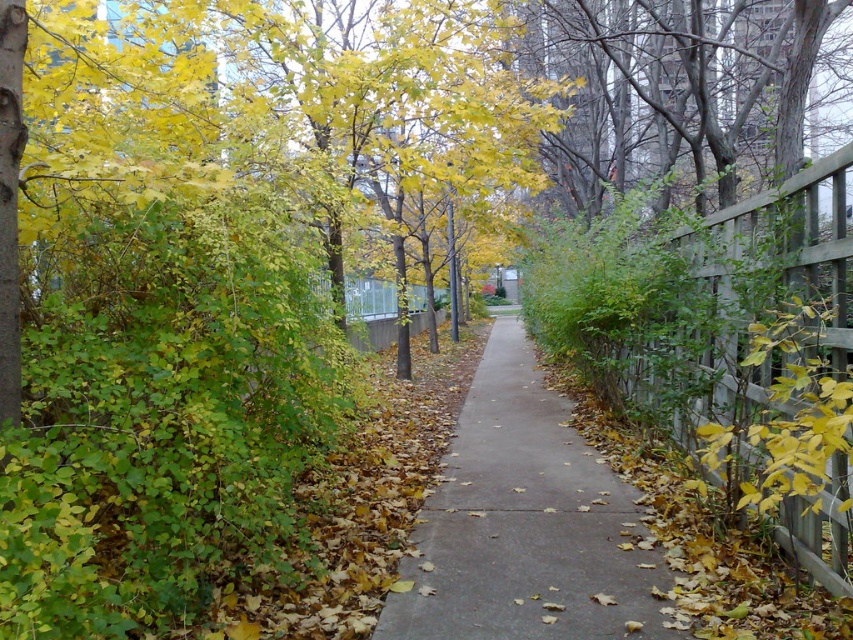
Question: Which object appears farthest from the camera in this image?

Choices:
 (A) wooden fence at right
 (B) gray concrete sidewalk at center

Answer: (B)

Question: Where is gray concrete sidewalk at center located in relation to wooden fence at right in the image?

Choices:
 (A) below
 (B) above

Answer: (A)

Question: Which point is closer to the camera?

Choices:
 (A) (654, 552)
 (B) (706, 244)

Answer: (A)

Question: Does gray concrete sidewalk at center have a greater width compared to wooden fence at right?

Choices:
 (A) yes
 (B) no

Answer: (A)

Question: Does gray concrete sidewalk at center have a larger size compared to wooden fence at right?

Choices:
 (A) yes
 (B) no

Answer: (B)